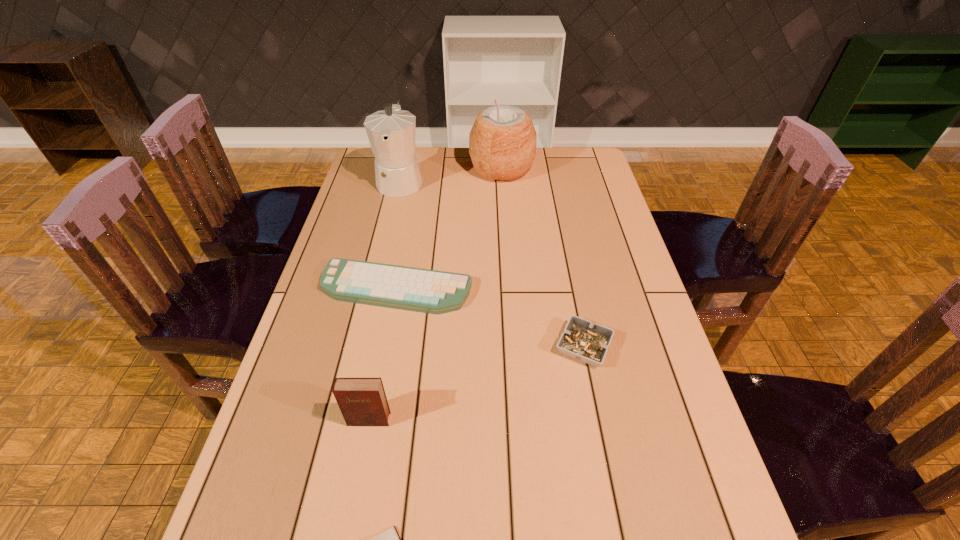
This screenshot has width=960, height=540. Identify the location of free space located 0.160m on the back of the third nearest object. (570, 279).

In order to click on vacant space located on the front of the fourth nearest object in this screenshot , I will do `click(375, 401)`.

Image resolution: width=960 pixels, height=540 pixels. Identify the location of coffeepot at the far edge. (391, 132).

At what (x,y) coordinates should I click in order to perform the action: click on coconut present at the far edge. Please return your answer as a coordinate pair (x, y). This screenshot has width=960, height=540. Looking at the image, I should click on (502, 142).

This screenshot has height=540, width=960. Identify the location of coffeepot at the left edge. (391, 132).

Find the location of a particular element. The height and width of the screenshot is (540, 960). computer keyboard at the left edge is located at coordinates (428, 291).

The width and height of the screenshot is (960, 540). Identify the location of object located in the right edge section of the desktop. (588, 342).

The height and width of the screenshot is (540, 960). What are the coordinates of `object present at the far left corner` in the screenshot? It's located at click(x=391, y=132).

In the image, there is a desktop. Where is `vacant area at the far edge`? The width and height of the screenshot is (960, 540). vacant area at the far edge is located at coordinates (439, 169).

Locate an element on the screen. This screenshot has width=960, height=540. vacant space at the left edge is located at coordinates (371, 231).